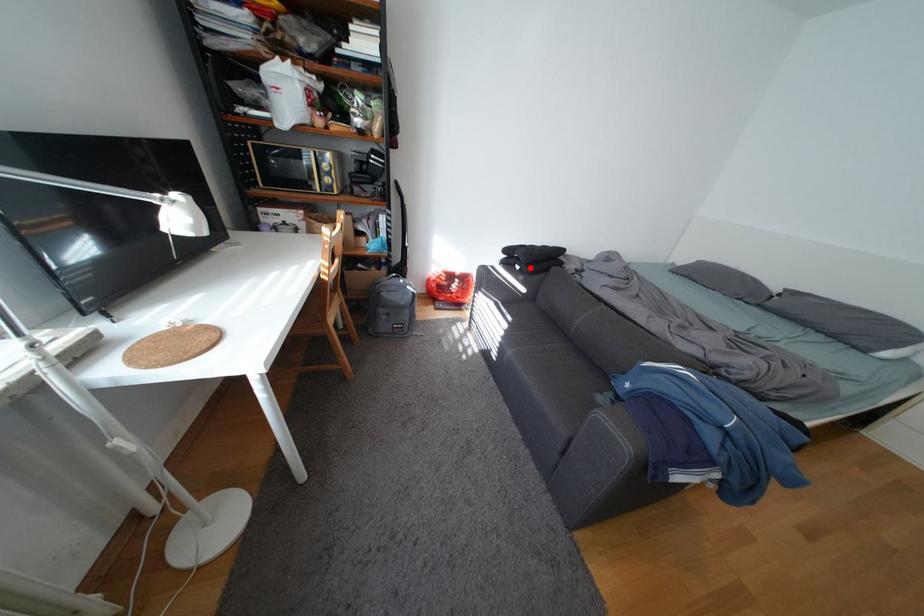
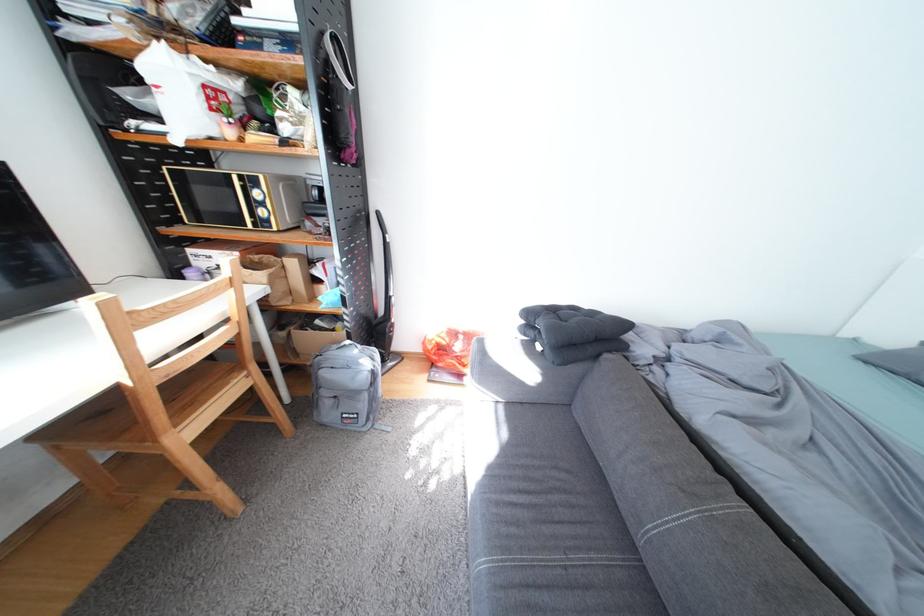
Question: A red point is marked in image1. In image2, is the corresponding 3D point closer to the camera or farther? Reply with the corresponding letter.

Choices:
 (A) The corresponding 3D point is closer.
 (B) The corresponding 3D point is farther.

Answer: (B)